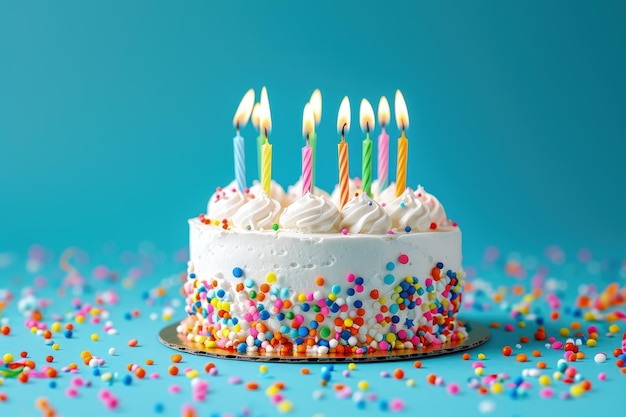
Image resolution: width=626 pixels, height=417 pixels. I want to click on birthday candles, so click(x=259, y=141), click(x=264, y=162), click(x=239, y=162), click(x=309, y=163), click(x=315, y=141), click(x=344, y=164), click(x=367, y=161), click(x=382, y=151), click(x=403, y=165).